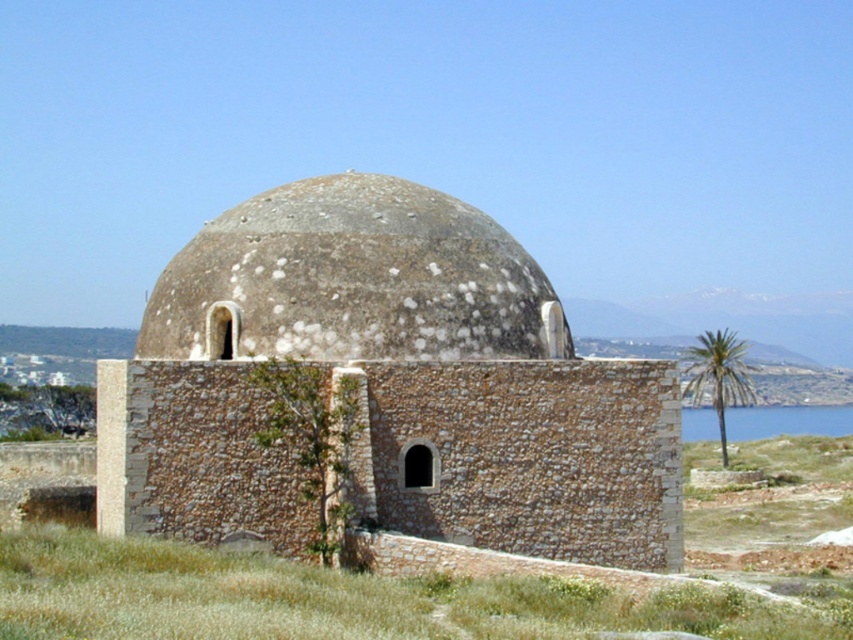
You are standing on the left side of the image and want to cross to the right side. There is a brown stone dome at center and blue water at right. Which object will you encounter first as you move towards the right?

You will first encounter the brown stone dome at center before reaching the blue water at right because it is positioned over the blue water at right, meaning it is closer to your starting position on the left side.